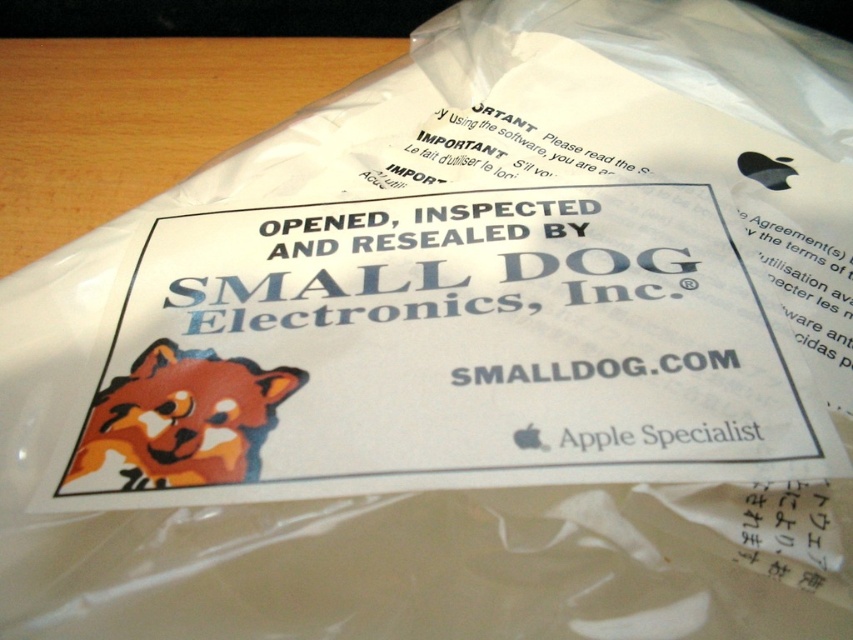
Question: Which point is closer to the camera?

Choices:
 (A) orange fur dog at center
 (B) wooden table at upper left

Answer: (A)

Question: Does wooden table at upper left appear on the left side of orange fur dog at center?

Choices:
 (A) no
 (B) yes

Answer: (B)

Question: Does wooden table at upper left have a smaller size compared to orange fur dog at center?

Choices:
 (A) no
 (B) yes

Answer: (A)

Question: Does wooden table at upper left appear under orange fur dog at center?

Choices:
 (A) no
 (B) yes

Answer: (A)

Question: Which of the following is the closest to the observer?

Choices:
 (A) wooden table at upper left
 (B) orange fur dog at center

Answer: (B)

Question: Which of the following is the farthest from the observer?

Choices:
 (A) (51, 106)
 (B) (77, 449)

Answer: (A)